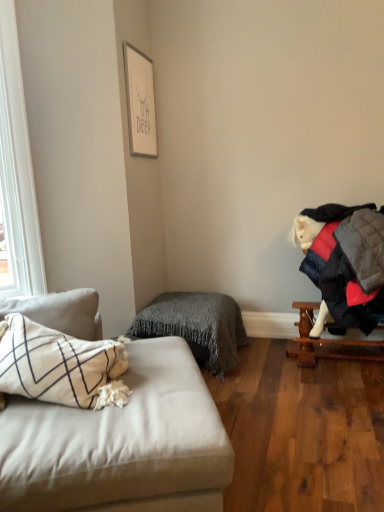
Where is `empty space that is ontop of white matte picture frame at upper center`? empty space that is ontop of white matte picture frame at upper center is located at coordinates (138, 47).